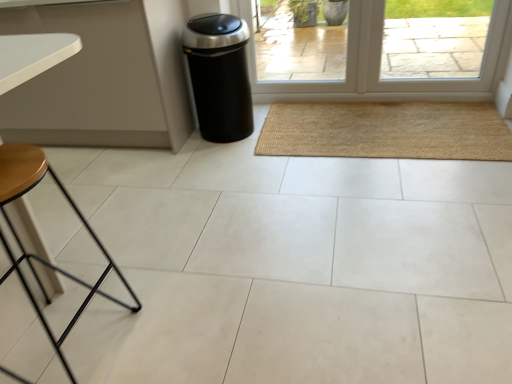
Question: From a real-world perspective, is black matte trash can at center-left positioned above or below natural fiber mat at center?

Choices:
 (A) below
 (B) above

Answer: (B)

Question: In the image, is black matte trash can at center-left positioned in front of or behind natural fiber mat at center?

Choices:
 (A) front
 (B) behind

Answer: (B)

Question: Estimate the real-world distances between objects in this image. Which object is closer to the black matte trash can at center-left?

Choices:
 (A) natural fiber mat at center
 (B) transparent glass door at center
 (C) wooden stool at lower left

Answer: (B)

Question: Which is nearer to the natural fiber mat at center?

Choices:
 (A) wooden stool at lower left
 (B) transparent glass door at center
 (C) black matte trash can at center-left

Answer: (B)